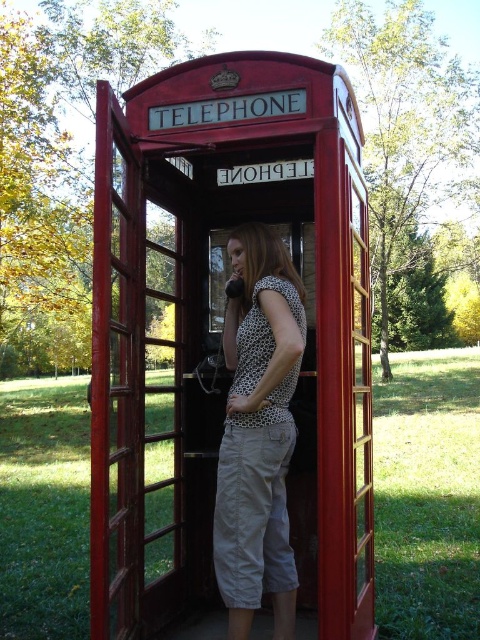
Does matte red telephone booth at center have a smaller size compared to polka dot fabric shirt at center?

Incorrect, matte red telephone booth at center is not smaller in size than polka dot fabric shirt at center.

Is point (127, 593) in front of point (239, 275)?

Yes, it is in front of point (239, 275).

I want to click on matte red telephone booth at center, so click(220, 330).